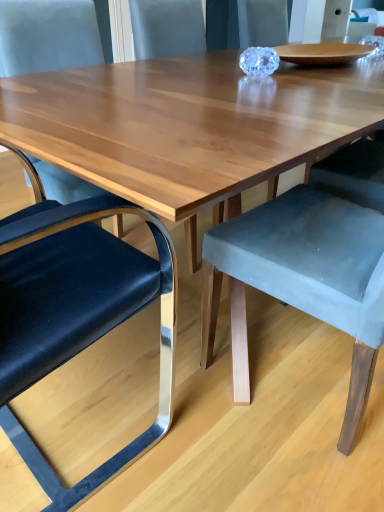
I want to click on free point to the right of metallic blue cushioned chair at left, which ranks as the third chair in right-to-left order, so click(216, 435).